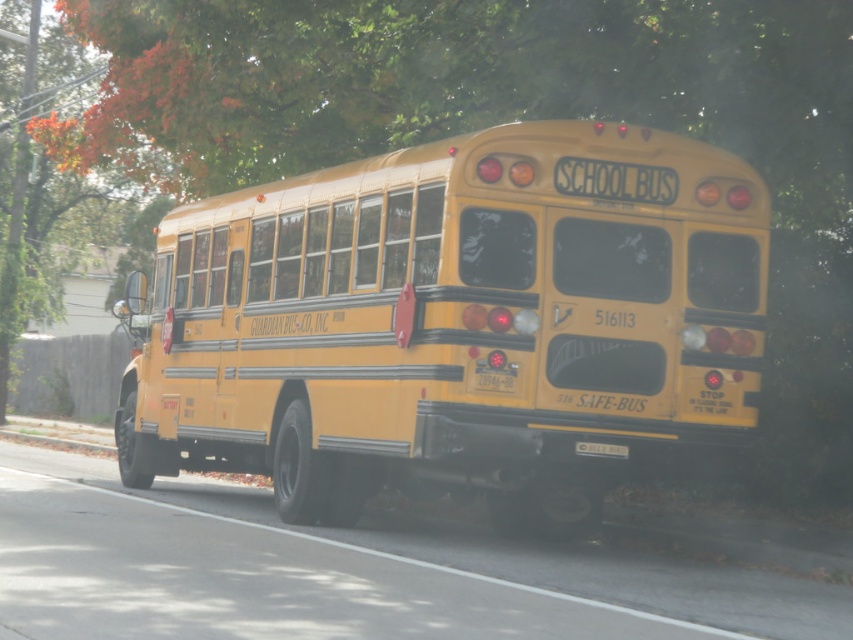
Measure the distance from yellow matte/solid school bus at center to black plastic license plate at rear.

yellow matte/solid school bus at center is 6.43 feet away from black plastic license plate at rear.

Who is more distant from viewer, [350,250] or [618,449]?

Positioned behind is point [350,250].

Locate an element on the screen. The width and height of the screenshot is (853, 640). yellow matte/solid school bus at center is located at coordinates (457, 323).